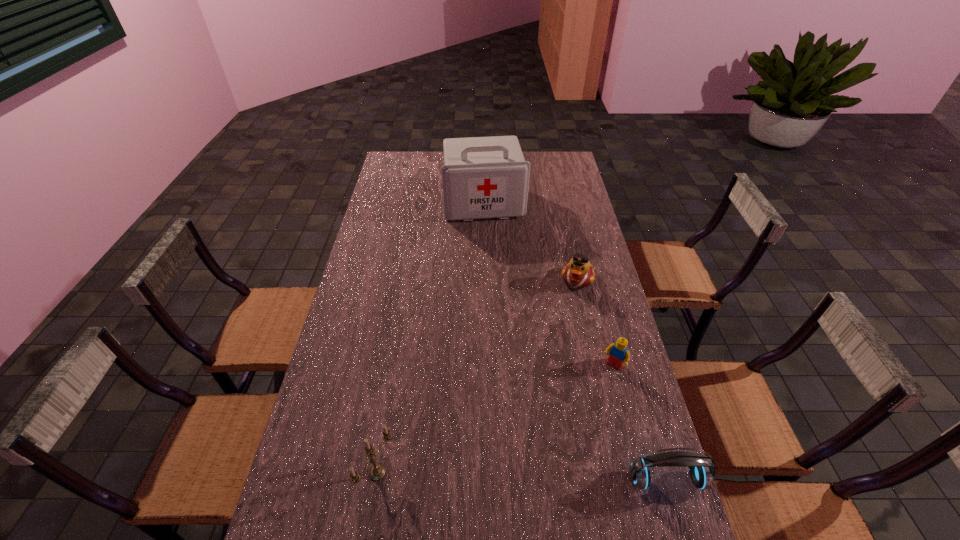
This screenshot has height=540, width=960. What are the coordinates of `free space on the desktop that is between the candle and the headset and is positioned on the front-facing side of the second object from left to right` in the screenshot? It's located at (533, 476).

Where is `vacant space on the desktop that is between the leftmost object and the headset and is positioned on the front-facing side of the Lego`? vacant space on the desktop that is between the leftmost object and the headset and is positioned on the front-facing side of the Lego is located at coordinates (539, 476).

Find the location of a particular element. vacant space on the desktop that is between the candle and the headset and is positioned on the face of the duck is located at coordinates (513, 476).